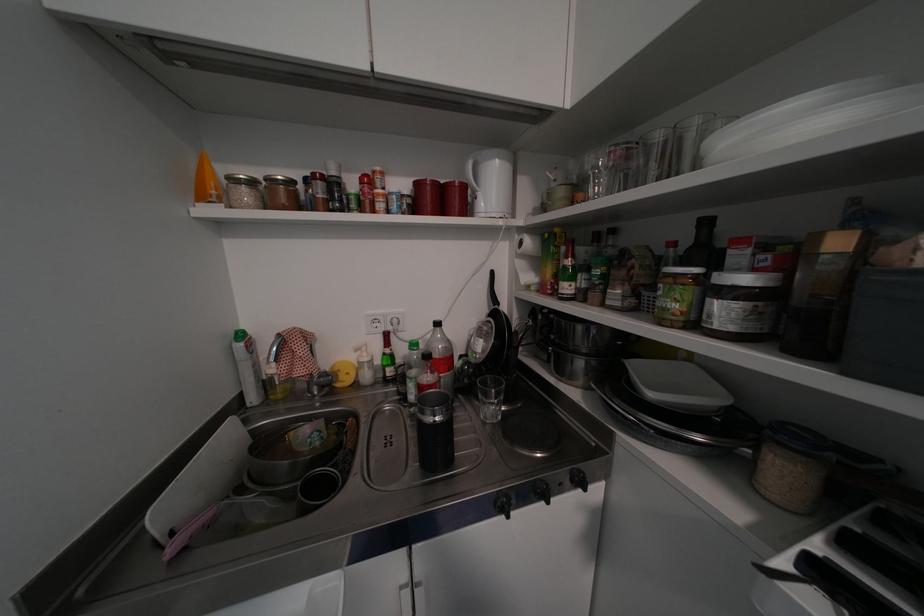
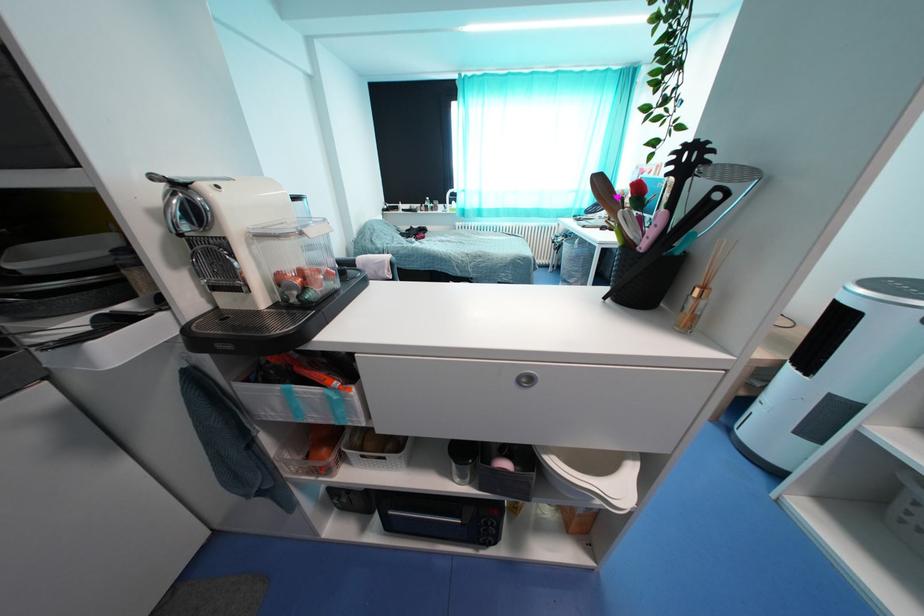
The images are taken continuously from a first-person perspective. In which direction is your viewpoint rotating?

The camera rotated toward right-down.